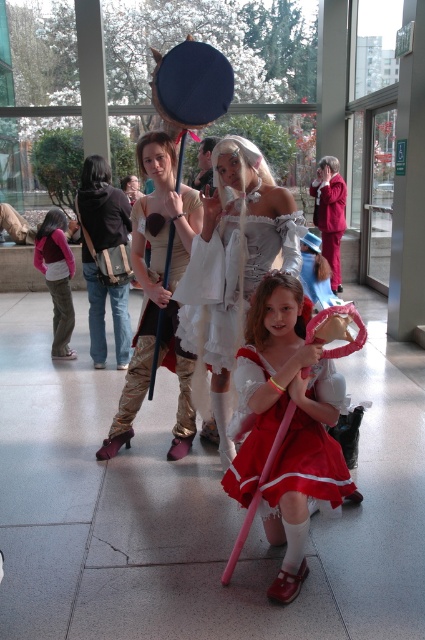
Question: Is matte red dress at center thinner than white lace dress at center?

Choices:
 (A) yes
 (B) no

Answer: (A)

Question: Which object is the farthest from the matte gold armor at center?

Choices:
 (A) white lace dress at center
 (B) matte red dress at center
 (C) matte pink sweater at left

Answer: (C)

Question: Can you confirm if matte gold armor at center is wider than velvet red cape at center?

Choices:
 (A) no
 (B) yes

Answer: (B)

Question: Is white lace dress at center thinner than white satin dress at center?

Choices:
 (A) yes
 (B) no

Answer: (B)

Question: Which point is farther to the camera?

Choices:
 (A) white lace dress at center
 (B) matte red dress at center
 (C) white satin dress at center
 (D) matte pink sweater at left

Answer: (D)

Question: Which object is positioned closest to the velvet red cape at center?

Choices:
 (A) white satin dress at center
 (B) matte pink sweater at left
 (C) matte red dress at center
 (D) matte gold armor at center

Answer: (B)